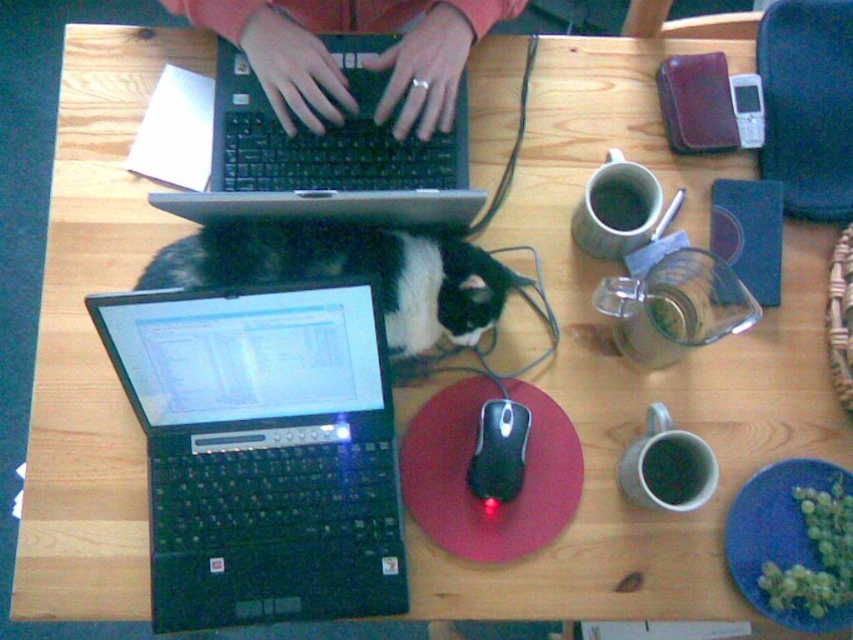
Question: Among these objects, which one is farthest from the camera?

Choices:
 (A) matte black hands at center
 (B) black fur cat at center

Answer: (A)

Question: Which object appears farthest from the camera in this image?

Choices:
 (A) matte black hands at center
 (B) black matte laptop at upper left
 (C) black plastic laptop at center
 (D) black plastic mouse at center

Answer: (A)

Question: Which object is positioned closest to the black matte laptop at upper left?

Choices:
 (A) black plastic laptop at center
 (B) matte black hands at center
 (C) black fur cat at center

Answer: (B)

Question: Does black plastic laptop at center have a greater width compared to matte black hands at center?

Choices:
 (A) no
 (B) yes

Answer: (A)

Question: Does black fur cat at center come in front of matte black hands at center?

Choices:
 (A) no
 (B) yes

Answer: (B)

Question: Is matte black hands at center to the left of black plastic mouse at center from the viewer's perspective?

Choices:
 (A) yes
 (B) no

Answer: (A)